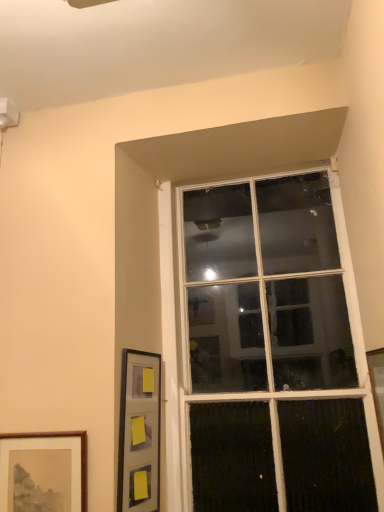
Where is `clear glass window at upper center`? clear glass window at upper center is located at coordinates (272, 351).

This screenshot has width=384, height=512. What do you see at coordinates (377, 386) in the screenshot?
I see `wooden picture frame at right, which is the 3th picture frame in left-to-right order` at bounding box center [377, 386].

This screenshot has width=384, height=512. In order to click on brown wooden picture frame at lower left, positioned as the first picture frame in left-to-right order in this screenshot , I will do (43, 472).

Does brown wooden picture frame at lower left, arranged as the third picture frame when viewed from the right, touch clear glass window at upper center?

No, brown wooden picture frame at lower left, arranged as the third picture frame when viewed from the right, is not with clear glass window at upper center.

In the image, is brown wooden picture frame at lower left, arranged as the third picture frame when viewed from the right, positioned in front of or behind clear glass window at upper center?

brown wooden picture frame at lower left, arranged as the third picture frame when viewed from the right, is positioned closer to the viewer than clear glass window at upper center.

From a real-world perspective, is brown wooden picture frame at lower left, positioned as the first picture frame in left-to-right order, positioned above or below clear glass window at upper center?

From a real-world perspective, brown wooden picture frame at lower left, positioned as the first picture frame in left-to-right order, is physically below clear glass window at upper center.

Based on the photo, would you say brown wooden picture frame at lower left, positioned as the first picture frame in left-to-right order, contains clear glass window at upper center?

No, clear glass window at upper center is located outside of brown wooden picture frame at lower left, positioned as the first picture frame in left-to-right order.

Is clear glass window at upper center completely or partially outside of wooden picture frame at right, which is the 3th picture frame in left-to-right order?

That's correct, clear glass window at upper center is outside of wooden picture frame at right, which is the 3th picture frame in left-to-right order.

Which object is closer to the camera, clear glass window at upper center or wooden picture frame at right, placed as the first picture frame when sorted from right to left?

wooden picture frame at right, placed as the first picture frame when sorted from right to left, is in front.

From a real-world perspective, is clear glass window at upper center positioned under wooden picture frame at right, placed as the first picture frame when sorted from right to left, based on gravity?

No, from a real-world perspective, clear glass window at upper center is not under wooden picture frame at right, placed as the first picture frame when sorted from right to left.

From the image's perspective, relative to wooden picture frame at right, placed as the first picture frame when sorted from right to left, is clear glass window at upper center above or below?

Clearly, from the image's perspective, clear glass window at upper center is above wooden picture frame at right, placed as the first picture frame when sorted from right to left.

Can you tell me how much wooden picture frame at right, which is the 3th picture frame in left-to-right order, and clear glass window at upper center differ in facing direction?

They differ by 89.6 degrees in their facing directions.

From the image's perspective, which object appears higher, wooden picture frame at right, which is the 3th picture frame in left-to-right order, or clear glass window at upper center?

From the image's view, clear glass window at upper center is above.

Which object is positioned more to the right, wooden picture frame at right, which is the 3th picture frame in left-to-right order, or clear glass window at upper center?

Positioned to the right is wooden picture frame at right, which is the 3th picture frame in left-to-right order.

Would you say wooden picture frame at right, which is the 3th picture frame in left-to-right order, contains clear glass window at upper center?

Actually, clear glass window at upper center is outside wooden picture frame at right, which is the 3th picture frame in left-to-right order.

Is brown wooden picture frame at lower left, arranged as the third picture frame when viewed from the right, bigger than wooden picture frame at right, which is the 3th picture frame in left-to-right order?

No, brown wooden picture frame at lower left, arranged as the third picture frame when viewed from the right, is not bigger than wooden picture frame at right, which is the 3th picture frame in left-to-right order.

Does brown wooden picture frame at lower left, arranged as the third picture frame when viewed from the right, have a greater height compared to wooden picture frame at right, which is the 3th picture frame in left-to-right order?

In fact, brown wooden picture frame at lower left, arranged as the third picture frame when viewed from the right, may be shorter than wooden picture frame at right, which is the 3th picture frame in left-to-right order.

Could matte black picture frame at lower left, the second picture frame positioned from the right, be considered to be inside wooden picture frame at right, placed as the first picture frame when sorted from right to left?

No, matte black picture frame at lower left, the second picture frame positioned from the right, is not a part of wooden picture frame at right, placed as the first picture frame when sorted from right to left.

Is wooden picture frame at right, which is the 3th picture frame in left-to-right order, thinner than matte black picture frame at lower left, the second picture frame positioned from the right?

No, wooden picture frame at right, which is the 3th picture frame in left-to-right order, is not thinner than matte black picture frame at lower left, the second picture frame positioned from the right.

In the scene shown: Is wooden picture frame at right, which is the 3th picture frame in left-to-right order, closer to camera compared to matte black picture frame at lower left, the second picture frame positioned from the right?

Yes, it is.

How many degrees apart are the facing directions of wooden picture frame at right, which is the 3th picture frame in left-to-right order, and matte black picture frame at lower left, arranged as the 2th picture frame when viewed from the left?

They differ by 167 degrees in their facing directions.

Could you tell me if matte black picture frame at lower left, the second picture frame positioned from the right, is facing clear glass window at upper center?

No, matte black picture frame at lower left, the second picture frame positioned from the right, is not facing towards clear glass window at upper center.

What are the coordinates of `window lying above the matte black picture frame at lower left, arranged as the 2th picture frame when viewed from the left (from the image's perspective)` in the screenshot? It's located at (272, 351).

From the image's perspective, is matte black picture frame at lower left, the second picture frame positioned from the right, located above or below clear glass window at upper center?

From the image's perspective, matte black picture frame at lower left, the second picture frame positioned from the right, appears below clear glass window at upper center.

Is clear glass window at upper center positioned with its back to matte black picture frame at lower left, the second picture frame positioned from the right?

No, clear glass window at upper center is not facing the opposite direction of matte black picture frame at lower left, the second picture frame positioned from the right.

Considering the relative positions of clear glass window at upper center and matte black picture frame at lower left, arranged as the 2th picture frame when viewed from the left, in the image provided, is clear glass window at upper center to the right of matte black picture frame at lower left, arranged as the 2th picture frame when viewed from the left, from the viewer's perspective?

Indeed, clear glass window at upper center is positioned on the right side of matte black picture frame at lower left, arranged as the 2th picture frame when viewed from the left.

How many degrees apart are the facing directions of clear glass window at upper center and matte black picture frame at lower left, the second picture frame positioned from the right?

The angular difference between clear glass window at upper center and matte black picture frame at lower left, the second picture frame positioned from the right, is 77.4 degrees.

This screenshot has height=512, width=384. What are the coordinates of `window above the matte black picture frame at lower left, the second picture frame positioned from the right (from a real-world perspective)` in the screenshot? It's located at (272, 351).

Where is `window above the brown wooden picture frame at lower left, positioned as the first picture frame in left-to-right order (from a real-world perspective)`? window above the brown wooden picture frame at lower left, positioned as the first picture frame in left-to-right order (from a real-world perspective) is located at coordinates click(x=272, y=351).

From the clear glass window at upper center, count 3rd picture frames forward and point to it. Please provide its 2D coordinates.

[(377, 386)]

From the image, which object appears to be nearer to brown wooden picture frame at lower left, arranged as the third picture frame when viewed from the right, wooden picture frame at right, which is the 3th picture frame in left-to-right order, or clear glass window at upper center?

clear glass window at upper center is positioned closer to the anchor brown wooden picture frame at lower left, arranged as the third picture frame when viewed from the right.

Looking at the image, which one is located further to wooden picture frame at right, which is the 3th picture frame in left-to-right order, clear glass window at upper center or matte black picture frame at lower left, the second picture frame positioned from the right?

The object further to wooden picture frame at right, which is the 3th picture frame in left-to-right order, is matte black picture frame at lower left, the second picture frame positioned from the right.

Looking at the image, which one is located closer to wooden picture frame at right, which is the 3th picture frame in left-to-right order, brown wooden picture frame at lower left, positioned as the first picture frame in left-to-right order, or matte black picture frame at lower left, arranged as the 2th picture frame when viewed from the left?

matte black picture frame at lower left, arranged as the 2th picture frame when viewed from the left, is closer to wooden picture frame at right, which is the 3th picture frame in left-to-right order.

From the image, which object appears to be nearer to clear glass window at upper center, matte black picture frame at lower left, arranged as the 2th picture frame when viewed from the left, or brown wooden picture frame at lower left, arranged as the third picture frame when viewed from the right?

matte black picture frame at lower left, arranged as the 2th picture frame when viewed from the left, is positioned closer to the anchor clear glass window at upper center.

When comparing their distances from clear glass window at upper center, does wooden picture frame at right, which is the 3th picture frame in left-to-right order, or brown wooden picture frame at lower left, arranged as the third picture frame when viewed from the right, seem closer?

wooden picture frame at right, which is the 3th picture frame in left-to-right order.

Considering their positions, is matte black picture frame at lower left, arranged as the 2th picture frame when viewed from the left, positioned closer to wooden picture frame at right, which is the 3th picture frame in left-to-right order, than clear glass window at upper center?

The object closer to wooden picture frame at right, which is the 3th picture frame in left-to-right order, is clear glass window at upper center.

When comparing their distances from clear glass window at upper center, does matte black picture frame at lower left, the second picture frame positioned from the right, or wooden picture frame at right, which is the 3th picture frame in left-to-right order, seem further?

wooden picture frame at right, which is the 3th picture frame in left-to-right order.

Which object lies nearer to the anchor point matte black picture frame at lower left, the second picture frame positioned from the right, wooden picture frame at right, placed as the first picture frame when sorted from right to left, or brown wooden picture frame at lower left, positioned as the first picture frame in left-to-right order?

brown wooden picture frame at lower left, positioned as the first picture frame in left-to-right order.

Where is `picture frame between brown wooden picture frame at lower left, arranged as the third picture frame when viewed from the right, and wooden picture frame at right, placed as the first picture frame when sorted from right to left, in the horizontal direction`? This screenshot has height=512, width=384. picture frame between brown wooden picture frame at lower left, arranged as the third picture frame when viewed from the right, and wooden picture frame at right, placed as the first picture frame when sorted from right to left, in the horizontal direction is located at coordinates (139, 432).

I want to click on window between matte black picture frame at lower left, arranged as the 2th picture frame when viewed from the left, and wooden picture frame at right, placed as the first picture frame when sorted from right to left, from left to right, so click(272, 351).

Locate an element on the screen. picture frame between brown wooden picture frame at lower left, positioned as the first picture frame in left-to-right order, and clear glass window at upper center is located at coordinates (139, 432).

Where is `window between brown wooden picture frame at lower left, arranged as the third picture frame when viewed from the right, and wooden picture frame at right, which is the 3th picture frame in left-to-right order`? The width and height of the screenshot is (384, 512). window between brown wooden picture frame at lower left, arranged as the third picture frame when viewed from the right, and wooden picture frame at right, which is the 3th picture frame in left-to-right order is located at coordinates (272, 351).